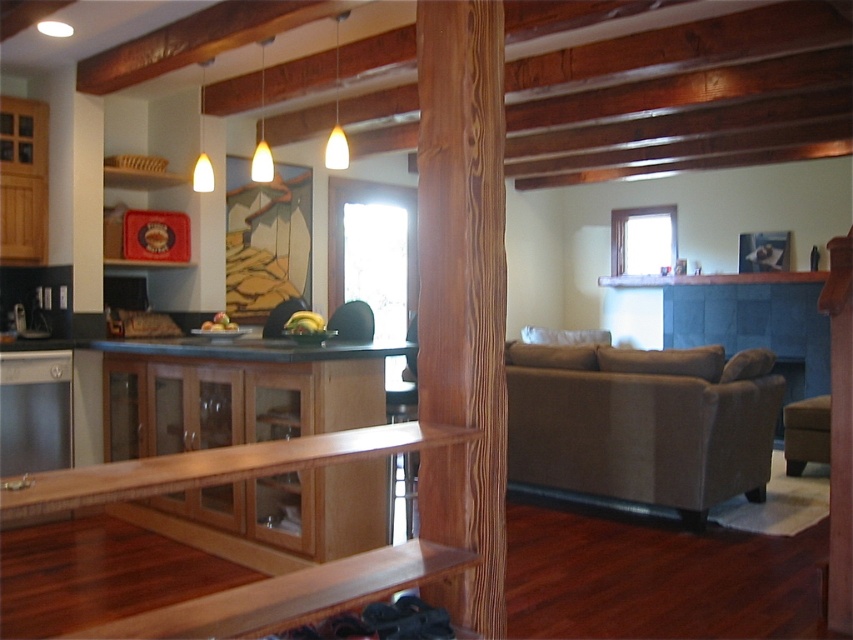
You are planning to move a large dining table into the space between the beige fabric couch at lower right and the satin stainless steel dishwasher at left. Based on the scene description, can you determine if there is enough space for the table?

The beige fabric couch at lower right is to the right of the satin stainless steel dishwasher at left, but the distance between them is not specified. Without knowing the exact dimensions of the space or the table, it is impossible to determine if there is enough room.

From the picture: You are a delivery person trying to place a large package between the beige fabric couch at lower right and the brown leather stool at lower right. The package measures 4 feet in length. Can you fit it in the space between them?

The distance between the beige fabric couch at lower right and the brown leather stool at lower right is 4.27 feet. Since the package is 4 feet long, it can fit in the space between them as there is enough room.

Looking at this image, you are trying to clean behind the brown leather stool at lower right. Can you access the area behind it without moving the satin stainless steel dishwasher at left?

The satin stainless steel dishwasher at left is in front of the brown leather stool at lower right, so you cannot access the area behind the brown leather stool at lower right without moving the dishwasher first.